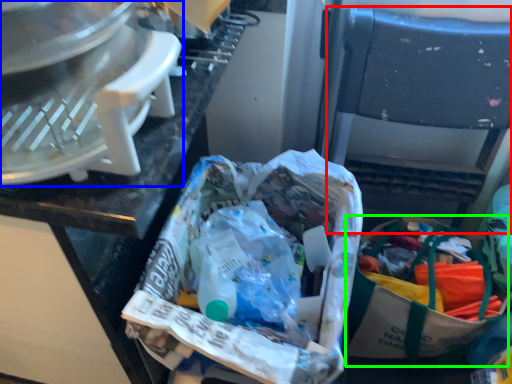
Question: Which object is positioned closest to folding chair (highlighted by a red box)? Select from kitchen appliance (highlighted by a blue box) and shopping bag (highlighted by a green box).

Choices:
 (A) kitchen appliance
 (B) shopping bag

Answer: (B)